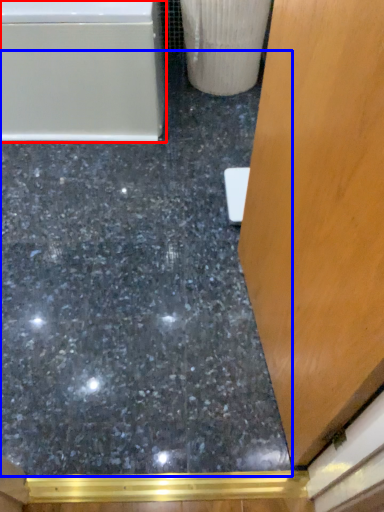
Question: Among these objects, which one is nearest to the camera, bathtub (highlighted by a red box) or concrete (highlighted by a blue box)?

Choices:
 (A) bathtub
 (B) concrete

Answer: (B)